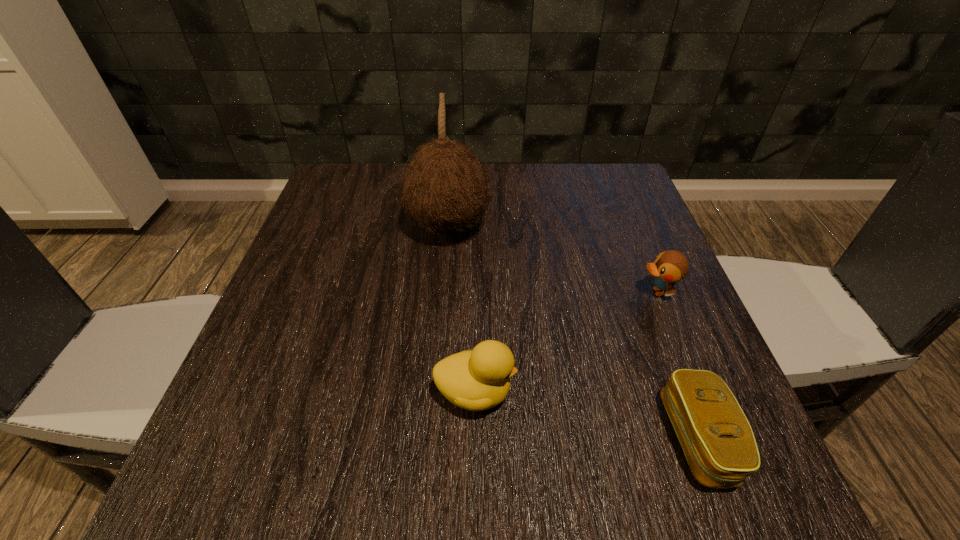
The height and width of the screenshot is (540, 960). Find the location of `vacant space located 0.400m on the front-facing side of the farther duck`. vacant space located 0.400m on the front-facing side of the farther duck is located at coordinates (434, 292).

The height and width of the screenshot is (540, 960). I want to click on vacant space located on the front-facing side of the farther duck, so click(x=525, y=292).

You are a GUI agent. You are given a task and a screenshot of the screen. Output one action in this format:
    pyautogui.click(x=<x>, y=<y>)
    Task: Click on the free space located on the zipper side of the clutch bag
    Image resolution: width=960 pixels, height=540 pixels.
    Given the screenshot: What is the action you would take?
    pyautogui.click(x=580, y=438)

I want to click on vacant area located on the zipper side of the clutch bag, so click(x=477, y=438).

Find the location of `free location located on the zipper side of the clutch bag`. free location located on the zipper side of the clutch bag is located at coordinates (593, 438).

You are a GUI agent. You are given a task and a screenshot of the screen. Output one action in this format:
    pyautogui.click(x=<x>, y=<y>)
    Task: Click on the object located at the far edge
    The image size is (960, 540).
    Given the screenshot: What is the action you would take?
    click(445, 188)

At what (x,y) coordinates should I click in order to perform the action: click on object present at the near edge. Please return your answer as a coordinate pair (x, y). The height and width of the screenshot is (540, 960). Looking at the image, I should click on (718, 442).

Where is `duck that is at the right edge`? duck that is at the right edge is located at coordinates (669, 267).

You are a GUI agent. You are given a task and a screenshot of the screen. Output one action in this format:
    pyautogui.click(x=<x>, y=<y>)
    Task: Click on the clutch bag that is at the right edge
    This screenshot has height=540, width=960.
    Given the screenshot: What is the action you would take?
    pyautogui.click(x=718, y=442)

Where is `object situated at the near right corner`? The height and width of the screenshot is (540, 960). object situated at the near right corner is located at coordinates (718, 442).